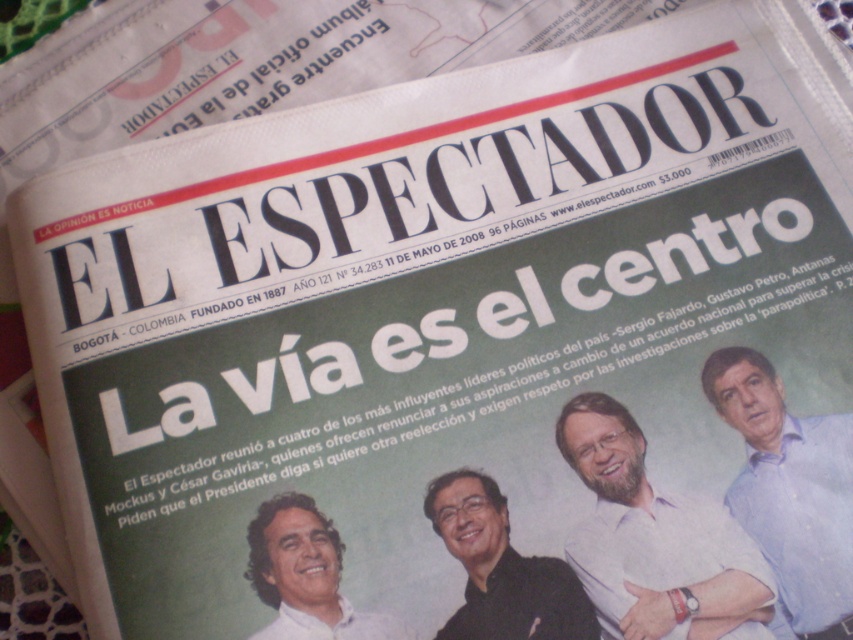
You are looking at the front page of the newspaper and notice the light purple shirt at center. Where exactly is this shirt positioned on the page?

The light purple shirt at center is located at point (654,540).

Based on the scene description, which object is taller between the light purple shirt at center and the black matte shirt at center?

The light purple shirt at center is much taller than the black matte shirt at center according to the description.

You are a journalist examining the front page of El Espectador from May 11, 2008. You notice two men in the photograph at the top of the page. One is wearing a light blue shirt at right and the other a black matte shirt at center. Which man appears to be in front of the other?

The light blue shirt at right is closer to the viewer than the black matte shirt at center, so the man in the light blue shirt at right appears to be in front of the man in the black matte shirt at center.